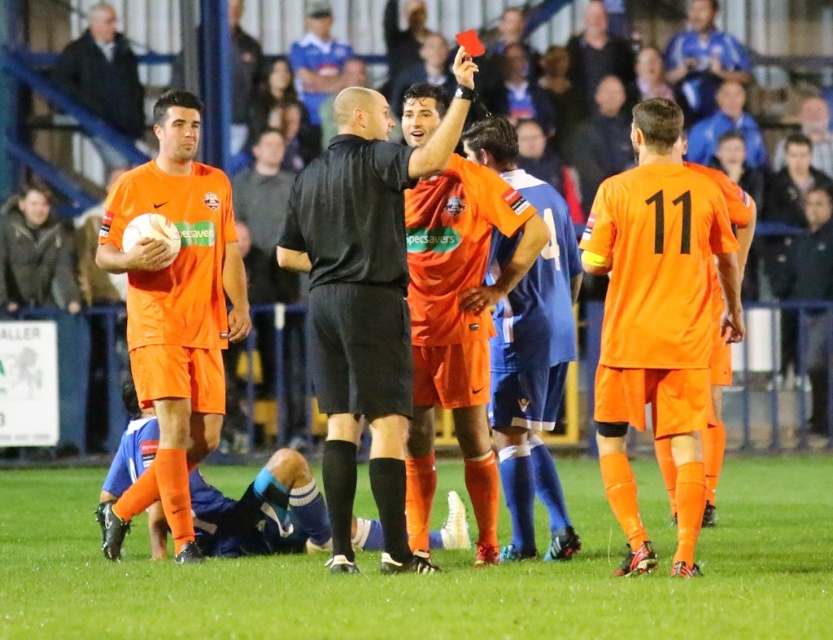
Question: Can you confirm if orange synthetic turf at center is smaller than orange matte/synthetic soccer player at center?

Choices:
 (A) no
 (B) yes

Answer: (A)

Question: Can you confirm if orange matte uniform at center is bigger than matte orange soccer uniform at left?

Choices:
 (A) no
 (B) yes

Answer: (B)

Question: Which object is positioned closest to the black matte referee at center?

Choices:
 (A) orange synthetic turf at center
 (B) dark gray jacket at upper left
 (C) matte orange soccer uniform at left

Answer: (C)

Question: Which of the following is the farthest from the observer?

Choices:
 (A) (153, 294)
 (B) (93, 76)
 (C) (382, 164)
 (D) (684, 500)

Answer: (B)

Question: Is black matte referee at center closer to camera compared to matte orange soccer uniform at left?

Choices:
 (A) no
 (B) yes

Answer: (B)

Question: Based on their relative distances, which object is nearer to the black matte referee at center?

Choices:
 (A) orange synthetic turf at center
 (B) orange matte uniform at center

Answer: (B)